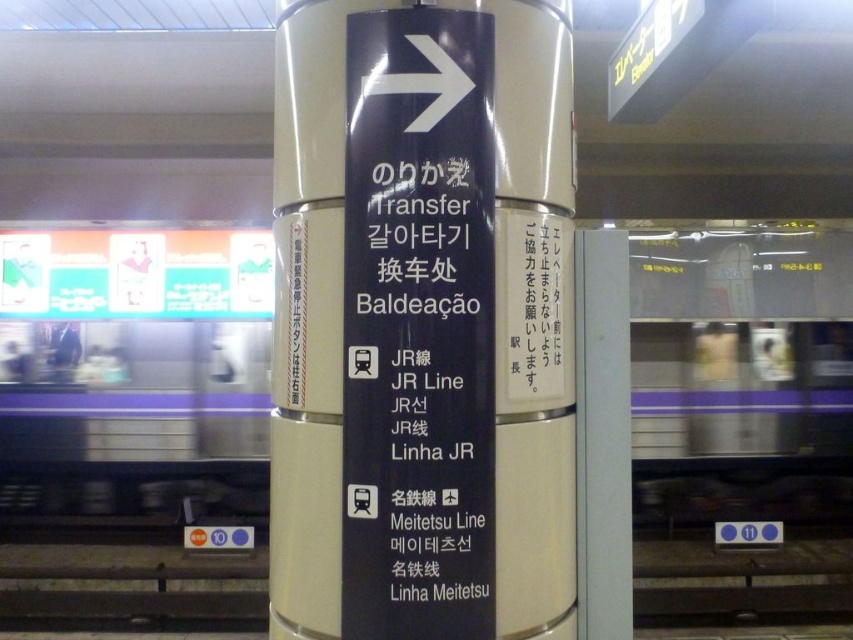
Is black glossy signpost at center taller than black plastic sign at center?

Yes.

Consider the image. Between black glossy signpost at center and black plastic sign at center, which one is positioned lower?

black plastic sign at center

The image size is (853, 640). I want to click on black glossy signpost at center, so click(422, 321).

Is black glossy signpost at center closer to camera compared to metallic silver train at center?

Yes, it is.

Is point (517, 157) closer to camera compared to point (129, 444)?

Yes, point (517, 157) is in front of point (129, 444).

Locate an element on the screen. black glossy signpost at center is located at coordinates (422, 321).

Is metallic silver train at center wider than black plastic sign at center?

Yes, metallic silver train at center is wider than black plastic sign at center.

Between metallic silver train at center and black plastic sign at center, which one appears on the right side from the viewer's perspective?

metallic silver train at center is more to the right.

Is point (700, 512) farther from camera compared to point (413, 188)?

Yes, point (700, 512) is farther from viewer.

Locate an element on the screen. This screenshot has width=853, height=640. metallic silver train at center is located at coordinates (132, 417).